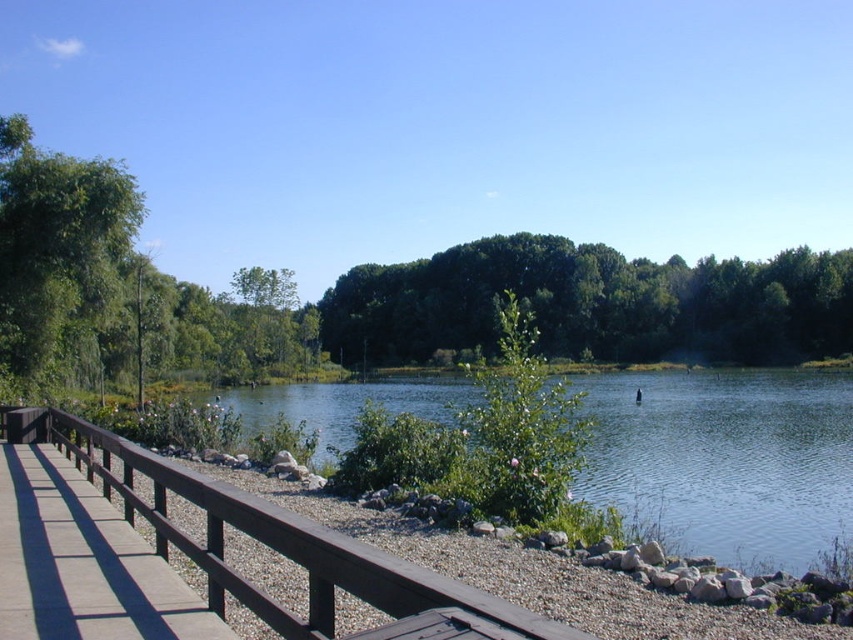
Who is shorter, clear water at center or brown wooden bridge at lower left?

brown wooden bridge at lower left

Which is below, clear water at center or brown wooden bridge at lower left?

Positioned lower is clear water at center.

Between point (809, 545) and point (54, 504), which one is positioned behind?

The point (809, 545) is more distant.

Where is `clear water at center`? clear water at center is located at coordinates (724, 460).

Who is higher up, brown wood rail at left or brown wooden bridge at lower left?

brown wood rail at left is higher up.

The height and width of the screenshot is (640, 853). Describe the element at coordinates (280, 547) in the screenshot. I see `brown wood rail at left` at that location.

Which is in front, point (210, 602) or point (132, 627)?

Point (132, 627) is more forward.

Find the location of a particular element. brown wood rail at left is located at coordinates (280, 547).

Does green leafy trees at center have a larger size compared to brown wooden bridge at lower left?

Indeed, green leafy trees at center has a larger size compared to brown wooden bridge at lower left.

In the scene shown: Is green leafy trees at center to the left of brown wooden bridge at lower left from the viewer's perspective?

No, green leafy trees at center is not to the left of brown wooden bridge at lower left.

Describe the element at coordinates (593, 304) in the screenshot. I see `green leafy trees at center` at that location.

You are a GUI agent. You are given a task and a screenshot of the screen. Output one action in this format:
    pyautogui.click(x=<x>, y=<y>)
    Task: Click on the green leafy trees at center
    
    Given the screenshot: What is the action you would take?
    pyautogui.click(x=593, y=304)